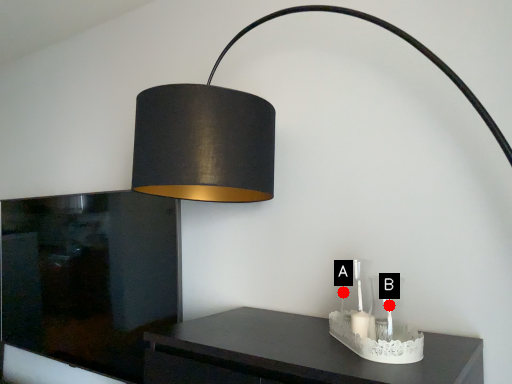
Question: Two points are circled on the image, labeled by A and B beside each circle. Which point appears farthest from the camera in this image?

Choices:
 (A) A is further
 (B) B is further

Answer: (A)